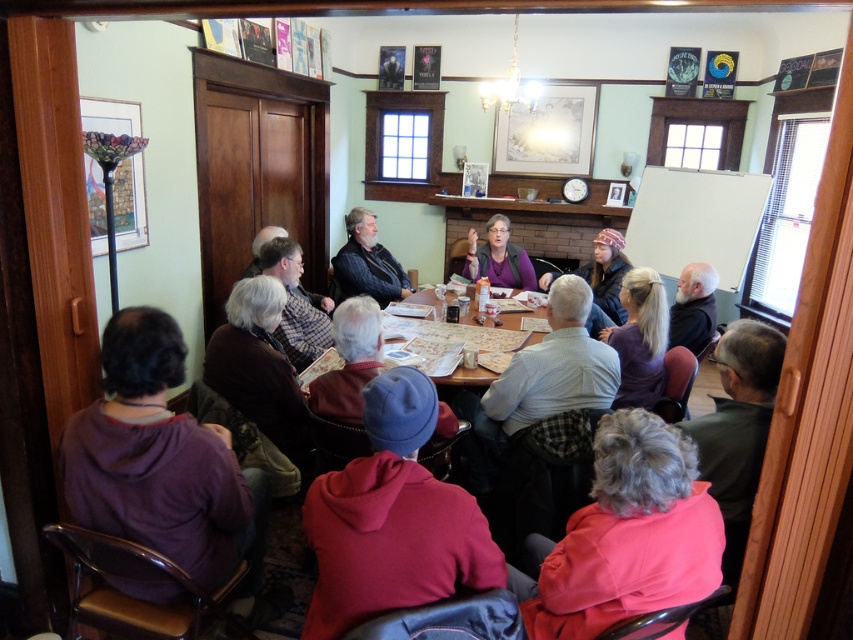
Can you confirm if pink fabric at lower right is shorter than dark gray sweater at center?

Indeed, pink fabric at lower right has a lesser height compared to dark gray sweater at center.

Which is in front, point (671, 534) or point (361, 225)?

Point (671, 534) is more forward.

Between point (596, 584) and point (361, 257), which one is positioned in front?

Point (596, 584) is in front.

Locate an element on the screen. pink fabric at lower right is located at coordinates (625, 536).

Which is below, purple hoodie at left or pink fabric at lower right?

pink fabric at lower right

Is point (119, 428) positioned behind point (711, 509)?

Yes, it is.

Locate an element on the screen. The image size is (853, 640). purple hoodie at left is located at coordinates (160, 461).

Can you confirm if purple hoodie at left is positioned above gray woolen sweater at lower left?

Incorrect, purple hoodie at left is not positioned above gray woolen sweater at lower left.

Who is more distant from viewer, (143, 588) or (264, 380)?

Point (264, 380)

In order to click on purple hoodie at left in this screenshot , I will do `click(160, 461)`.